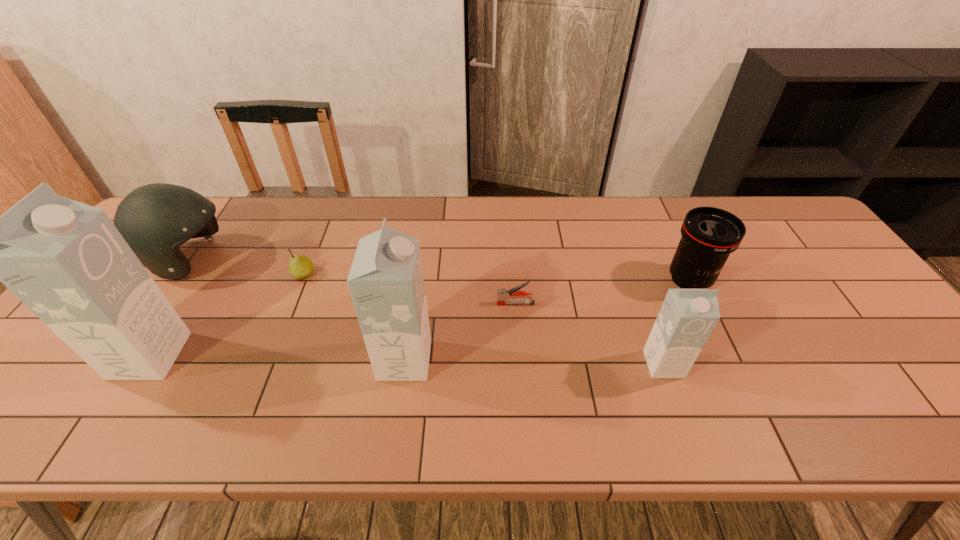
Considering the uniform spacing of cartons, where should an additional carton be positioned on the right? Please locate a free spot. Please provide its 2D coordinates. Your answer should be formatted as a tuple, i.e. [(x, y)], where the tuple contains the x and y coordinates of a point satisfying the conditions above.

[(926, 368)]